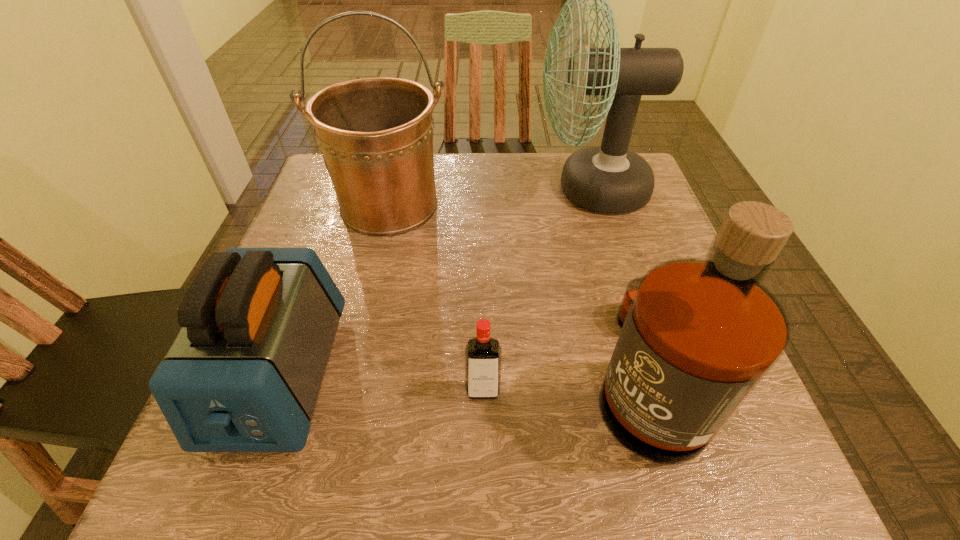
The width and height of the screenshot is (960, 540). I want to click on free space between the fourth tallest object and the shortest object, so click(382, 383).

Locate which object is the closest to the third object from left to right. Please provide its 2D coordinates. Your answer should be formatted as a tuple, i.e. [(x, y)], where the tuple contains the x and y coordinates of a point satisfying the conditions above.

[(698, 335)]

Select which object is the closest to the fan. Please provide its 2D coordinates. Your answer should be formatted as a tuple, i.e. [(x, y)], where the tuple contains the x and y coordinates of a point satisfying the conditions above.

[(375, 134)]

I want to click on free space that satisfies the following two spatial constraints: 1. on the front label of the liquor; 2. on the front-facing side of the fourth tallest object, so click(x=644, y=376).

The width and height of the screenshot is (960, 540). What are the coordinates of `vacant space that satisfies the following two spatial constraints: 1. in front of the fan where the airflow is directed; 2. on the front and back of the vodka` in the screenshot? It's located at (651, 391).